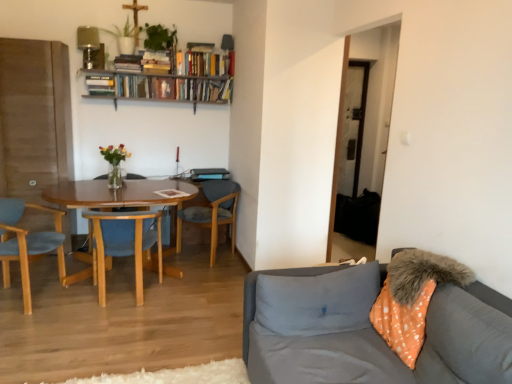
Question: Considering the positions of gray fabric couch at lower right and wooden bookshelf at upper center in the image, is gray fabric couch at lower right taller or shorter than wooden bookshelf at upper center?

Choices:
 (A) tall
 (B) short

Answer: (A)

Question: Relative to wooden bookshelf at upper center, is gray fabric couch at lower right in front or behind?

Choices:
 (A) behind
 (B) front

Answer: (B)

Question: Based on their relative distances, which object is farther from the wooden bookshelf at upper center?

Choices:
 (A) woodenchair at left, which ranks as the second chair in right-to-left order
 (B) wooden chair at center, positioned as the 1th chair in right-to-left order
 (C) light blue fabric chair at left, which appears as the first chair when viewed from the left
 (D) gray fabric couch at lower right
 (E) gray fabric pillow at lower right

Answer: (D)

Question: Which object is positioned closest to the gray fabric couch at lower right?

Choices:
 (A) woodenchair at left, which ranks as the second chair in right-to-left order
 (B) wooden chair at center, positioned as the 1th chair in right-to-left order
 (C) wooden bookshelf at upper center
 (D) gray fabric pillow at lower right
 (E) light blue fabric chair at left, which appears as the first chair when viewed from the left

Answer: (D)